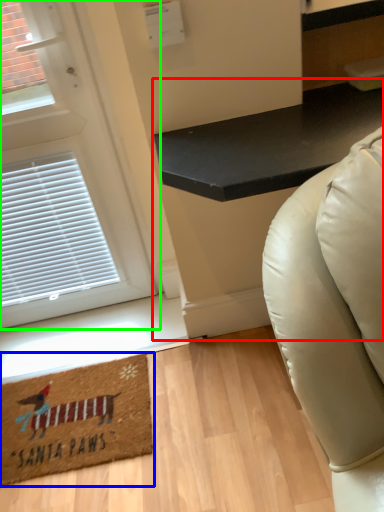
Question: Considering the real-world distances, which object is farthest from table (highlighted by a red box)? mat (highlighted by a blue box) or door (highlighted by a green box)?

Choices:
 (A) mat
 (B) door

Answer: (A)